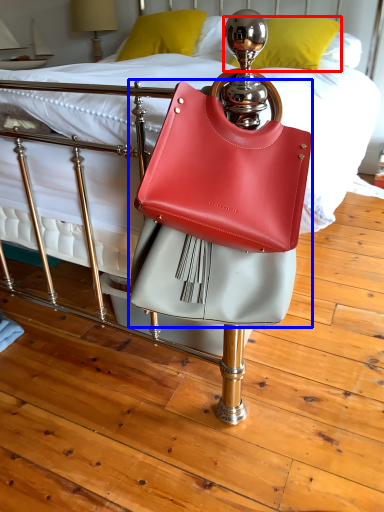
Question: Among these objects, which one is nearest to the camera, pillow (highlighted by a red box) or handbag (highlighted by a blue box)?

Choices:
 (A) pillow
 (B) handbag

Answer: (B)